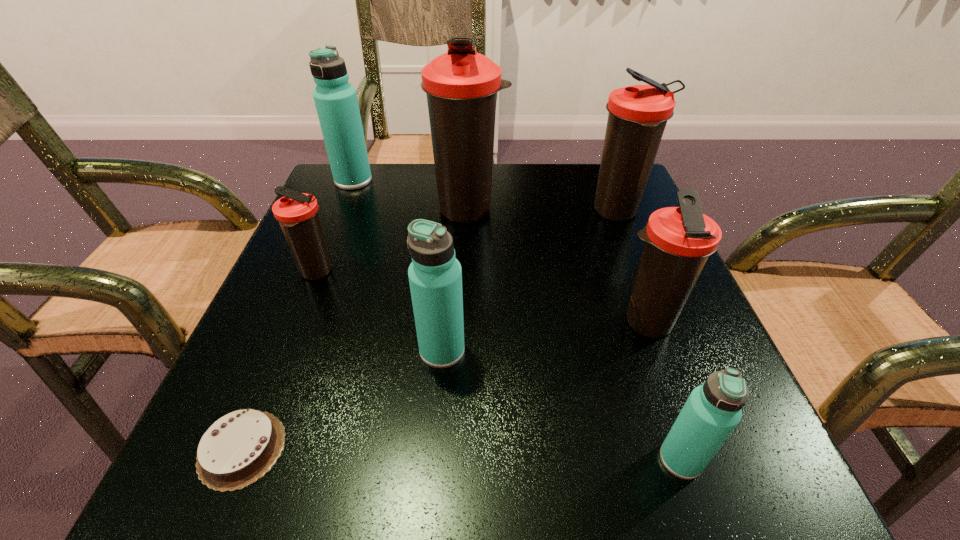
I want to click on vacant space that's between the second nearest brown thermos bottle and the biggest aqua thermos bottle, so click(x=335, y=227).

This screenshot has width=960, height=540. Find the location of `vacant point located between the third farthest brown thermos bottle and the nearest aqua thermos bottle`. vacant point located between the third farthest brown thermos bottle and the nearest aqua thermos bottle is located at coordinates (499, 366).

Identify the location of free space that is in between the chocolate cake and the second smallest aqua thermos bottle. (342, 400).

The width and height of the screenshot is (960, 540). I want to click on free point between the nearest thermos bottle and the nearest brown thermos bottle, so click(663, 392).

At what (x,y) coordinates should I click in order to perform the action: click on object that ranks as the closest to the second aqua thermos bottle from right to left. Please return your answer as a coordinate pair (x, y). Looking at the image, I should click on (241, 447).

Identify which object is the seventh nearest to the second aqua thermos bottle from left to right. Please provide its 2D coordinates. Your answer should be formatted as a tuple, i.e. [(x, y)], where the tuple contains the x and y coordinates of a point satisfying the conditions above.

[(336, 102)]

Identify which thermos bottle is the sixth closest to the second brown thermos bottle from left to right. Please provide its 2D coordinates. Your answer should be formatted as a tuple, i.e. [(x, y)], where the tuple contains the x and y coordinates of a point satisfying the conditions above.

[(713, 410)]

Image resolution: width=960 pixels, height=540 pixels. In order to click on the closest thermos bottle relative to the chocolate cake in this screenshot , I will do `click(435, 276)`.

Identify which brown thermos bottle is the nearest to the fifth nearest object. Please provide its 2D coordinates. Your answer should be formatted as a tuple, i.e. [(x, y)], where the tuple contains the x and y coordinates of a point satisfying the conditions above.

[(461, 85)]

Locate an element on the screen. The height and width of the screenshot is (540, 960). the third closest brown thermos bottle to the chocolate cake is located at coordinates (678, 240).